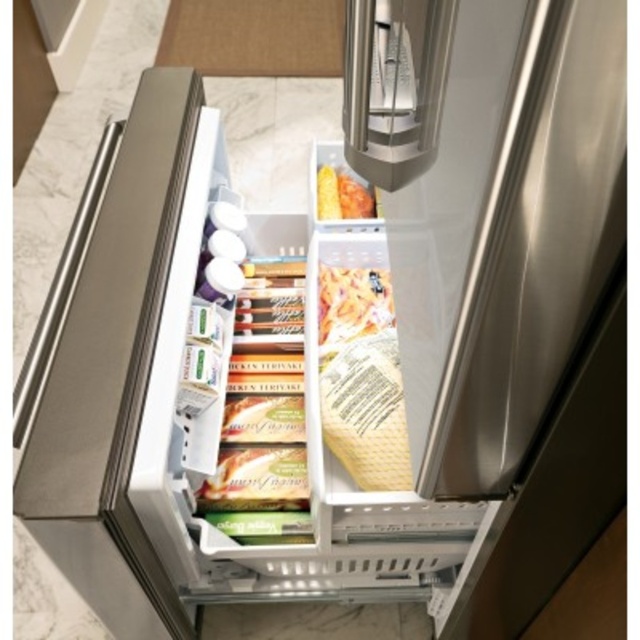
Question: Can you confirm if translucent plastic bag of pasta at center is positioned to the left of matte orange corn at center?

Choices:
 (A) yes
 (B) no

Answer: (B)

Question: Which object appears farthest from the camera in this image?

Choices:
 (A) matte orange corn at center
 (B) translucent plastic bag of pasta at center

Answer: (A)

Question: Which point appears farthest from the camera in this image?

Choices:
 (A) (323, 164)
 (B) (360, 337)

Answer: (A)

Question: From the image, what is the correct spatial relationship of translucent plastic bag of pasta at center in relation to matte orange corn at center?

Choices:
 (A) below
 (B) above

Answer: (A)

Question: Observing the image, what is the correct spatial positioning of translucent plastic bag of pasta at center in reference to matte orange corn at center?

Choices:
 (A) left
 (B) right

Answer: (B)